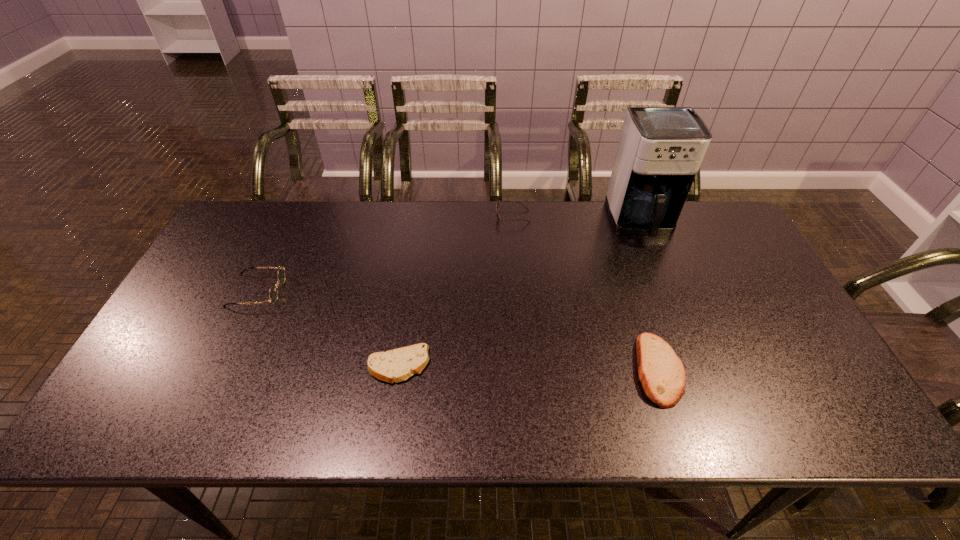
Find the location of a particular element. Image resolution: width=960 pixels, height=540 pixels. the tallest object is located at coordinates 660,150.

This screenshot has width=960, height=540. Identify the location of the second tallest object. (273, 292).

You are a GUI agent. You are given a task and a screenshot of the screen. Output one action in this format:
    pyautogui.click(x=<x>, y=<y>)
    Task: Click on the third nearest object
    
    Given the screenshot: What is the action you would take?
    pyautogui.click(x=273, y=292)

The width and height of the screenshot is (960, 540). Identify the location of the third object from left to right. (497, 205).

Locate an element on the screen. Image resolution: width=960 pixels, height=540 pixels. the right pita bread is located at coordinates (662, 374).

You are a GUI agent. You are given a task and a screenshot of the screen. Output one action in this format:
    pyautogui.click(x=<x>, y=<y>)
    Task: Click on the shorter pita bread
    This screenshot has height=540, width=960.
    Given the screenshot: What is the action you would take?
    pyautogui.click(x=396, y=365)

Where is `the left pita bread`? This screenshot has width=960, height=540. the left pita bread is located at coordinates (396, 365).

At what (x,y) coordinates should I click in order to perform the action: click on free location located 0.150m on the front panel of the tallest object. Please return your answer as a coordinate pair (x, y). The height and width of the screenshot is (540, 960). Looking at the image, I should click on (664, 282).

The image size is (960, 540). What are the coordinates of `free space located 0.130m on the lenses of the leftmost object` in the screenshot? It's located at (328, 291).

I want to click on vacant region located on the front-facing side of the sunglasses, so click(418, 217).